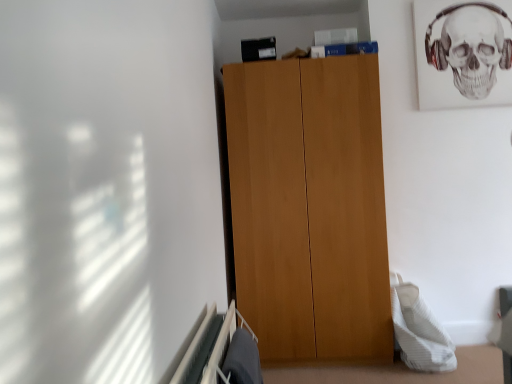
Question: Should I look upward or downward to see black matte skull at upper right?

Choices:
 (A) up
 (B) down

Answer: (A)